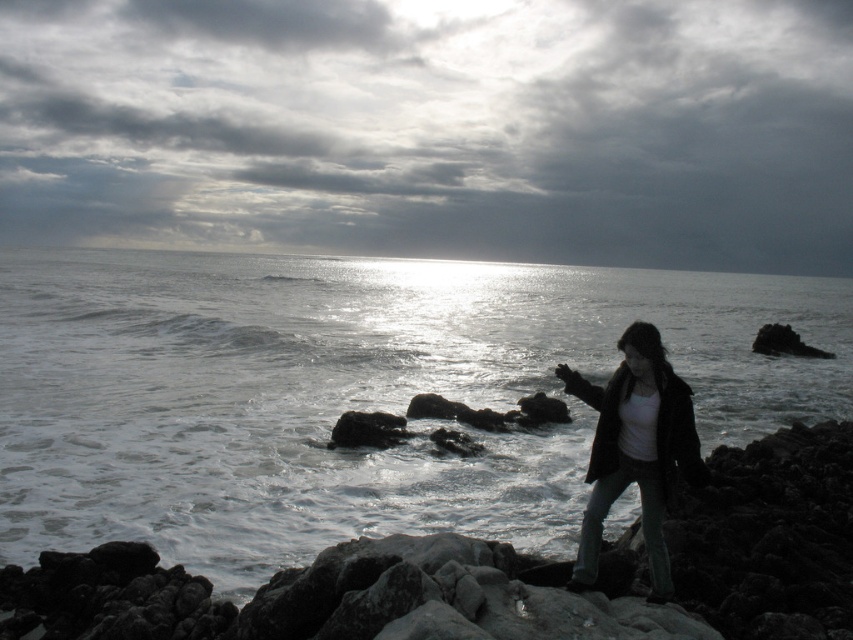
Can you confirm if glistening water at center is positioned below rough textured rocks at lower right?

Incorrect, glistening water at center is not positioned below rough textured rocks at lower right.

Identify the location of glistening water at center. This screenshot has width=853, height=640. (349, 394).

Where is `glistening water at center`? glistening water at center is located at coordinates (349, 394).

Image resolution: width=853 pixels, height=640 pixels. What do you see at coordinates (434, 129) in the screenshot?
I see `cloudy sky at upper center` at bounding box center [434, 129].

Is cloudy sky at upper center taller than glistening water at center?

Yes.

I want to click on cloudy sky at upper center, so click(434, 129).

Does rough textured rocks at lower right have a greater height compared to matte black jacket at lower right?

In fact, rough textured rocks at lower right may be shorter than matte black jacket at lower right.

Which is above, rough textured rocks at lower right or matte black jacket at lower right?

matte black jacket at lower right is higher up.

Where is `rough textured rocks at lower right`? rough textured rocks at lower right is located at coordinates (228, 602).